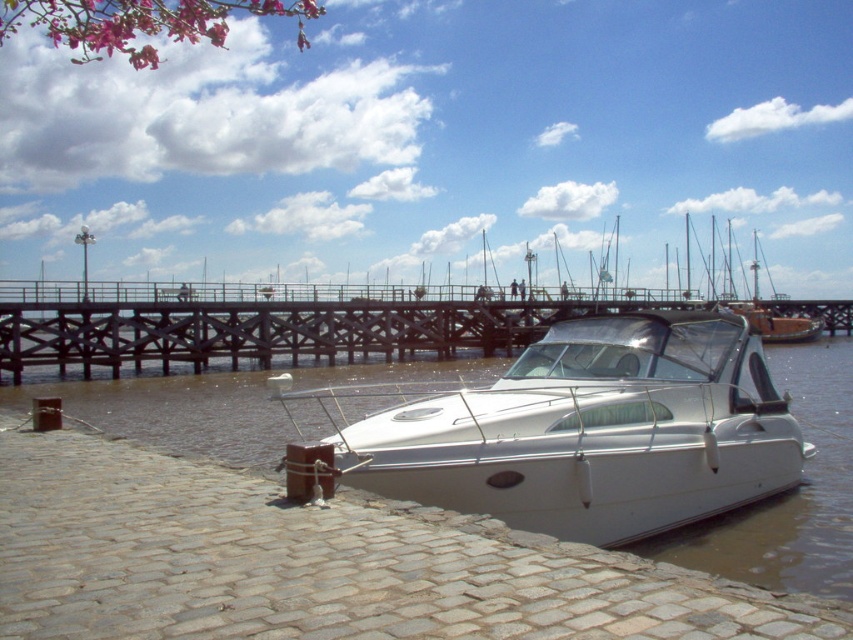
Is white glossy boat at center shorter than white glossy water at center?

No.

Which is in front, point (558, 358) or point (845, 340)?

Point (558, 358)

Locate an element on the screen. white glossy boat at center is located at coordinates (585, 429).

I want to click on white glossy boat at center, so click(x=585, y=429).

Is white glossy boat at center positioned at the back of white glossy dock at center?

No, white glossy boat at center is in front of white glossy dock at center.

Is point (602, 381) farther from camera compared to point (206, 310)?

That is False.

Is point (518, 403) behind point (347, 307)?

No, (518, 403) is in front of (347, 307).

Identify the location of white glossy boat at center. The image size is (853, 640). (585, 429).

Does point (761, 500) lie behind point (383, 337)?

No, (761, 500) is in front of (383, 337).

Is white glossy water at center in front of white glossy dock at center?

Yes, white glossy water at center is in front of white glossy dock at center.

Which is behind, point (672, 560) or point (173, 360)?

Point (173, 360)

Where is `white glossy water at center`? The width and height of the screenshot is (853, 640). white glossy water at center is located at coordinates (788, 492).